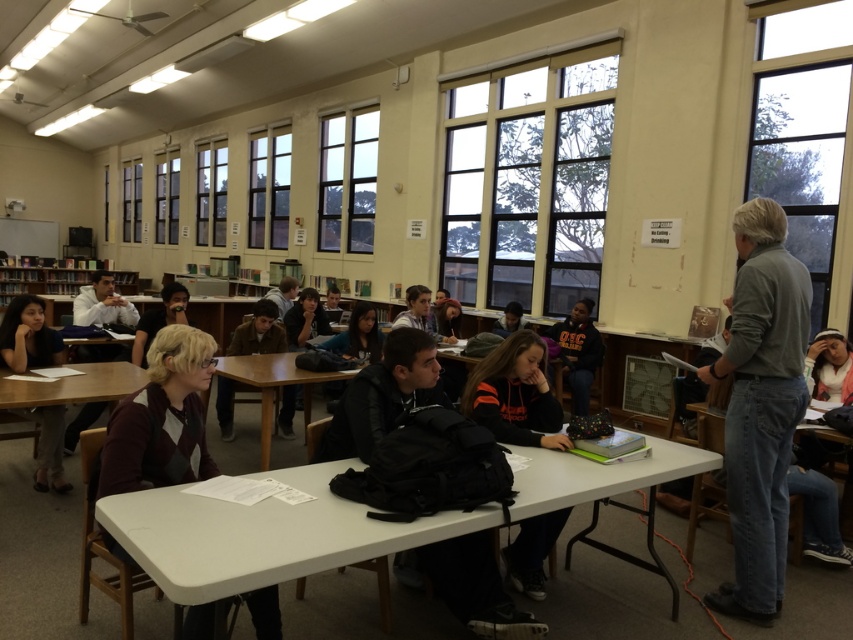
You are standing at the back of the classroom facing the front. There are two points marked in the image, point A at coordinates point (552, 413) and point B at coordinates point (573, 333). Which point is closer to you?

Point A at coordinates point (552, 413) is closer to you because it is closer to the camera than point B at coordinates point (573, 333).

Based on the photo, you are standing at the point labeled point (491, 356) in the classroom. You want to walk to the door that is 2.98 meters away from your current position. Is the door likely located in the front, back, or side of the classroom?

The door is likely located in the back of the classroom because the large windows along the back wall are mentioned, and the distance of 2.98 meters would place it within that area.

You are standing at point (42, 467) and want to walk to point (569, 490). Is the destination point in front of you or behind you?

The destination point (569, 490) is in front of your current position at point (42, 467), so it is in front of you.